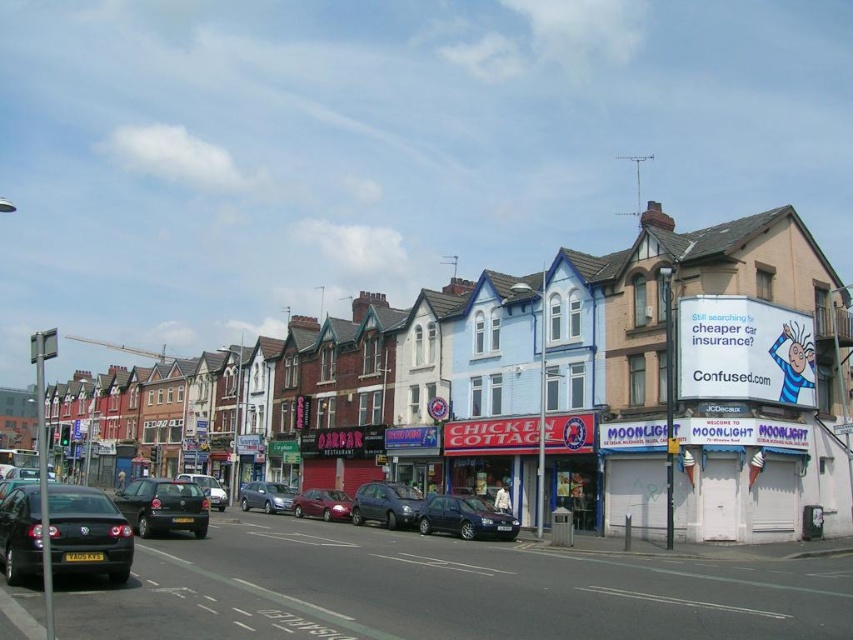
You are a delivery driver who needs to park your vehicle between the matte black car at left and the metallic blue hatchback at center. Is there enough space for your vehicle which is 4.5 meters long?

The matte black car at left is to the left of metallic blue hatchback at center, but the distance between them is not specified. Without knowing the exact space between the two cars, it is impossible to determine if your 4.5 meter vehicle can fit.

Consider the image. You are a pedestrian standing on the sidewalk in front of the Chicken Cottage. You see a metallic blue hatchback at center and a metallic red sedan at center parked on the street. Which car is closer to you?

The metallic blue hatchback at center is closer to the viewer than the metallic red sedan at center.